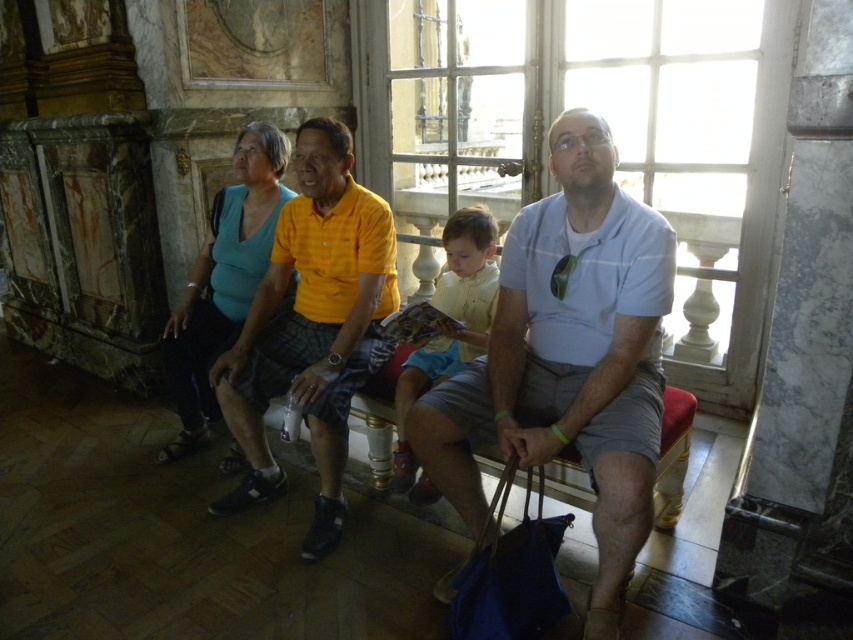
Does light blue cotton shirt at center have a greater height compared to yellow cotton shirt at center?

Indeed, light blue cotton shirt at center has a greater height compared to yellow cotton shirt at center.

Locate an element on the screen. This screenshot has height=640, width=853. light blue cotton shirt at center is located at coordinates (567, 356).

Does point (601, 476) come behind point (398, 483)?

No, (601, 476) is closer to viewer.

Identify the location of light blue cotton shirt at center. The width and height of the screenshot is (853, 640). (567, 356).

Does light blue cotton shirt at center have a smaller size compared to matte yellow shirt at center?

Indeed, light blue cotton shirt at center has a smaller size compared to matte yellow shirt at center.

How much distance is there between light blue cotton shirt at center and matte yellow shirt at center?

light blue cotton shirt at center is 24.22 inches from matte yellow shirt at center.

The width and height of the screenshot is (853, 640). What do you see at coordinates (567, 356) in the screenshot?
I see `light blue cotton shirt at center` at bounding box center [567, 356].

You are a GUI agent. You are given a task and a screenshot of the screen. Output one action in this format:
    pyautogui.click(x=<x>, y=<y>)
    Task: Click on the light blue cotton shirt at center
    This screenshot has width=853, height=640.
    Given the screenshot: What is the action you would take?
    pyautogui.click(x=567, y=356)

Which is below, matte yellow shirt at center or teal fabric shirt at center?

matte yellow shirt at center is below.

Is matte yellow shirt at center wider than teal fabric shirt at center?

Yes, matte yellow shirt at center is wider than teal fabric shirt at center.

The width and height of the screenshot is (853, 640). I want to click on matte yellow shirt at center, so click(x=312, y=326).